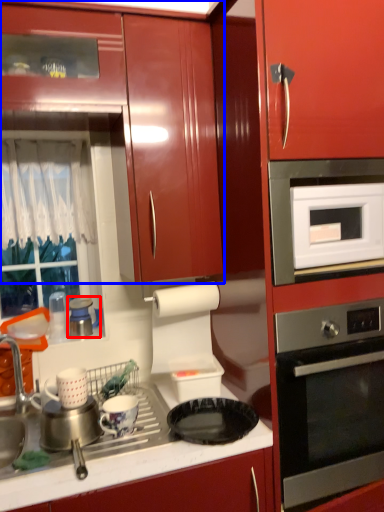
Question: Which of the following is the farthest to the observer, appliance (highlighted by a red box) or cabinetry (highlighted by a blue box)?

Choices:
 (A) appliance
 (B) cabinetry

Answer: (A)